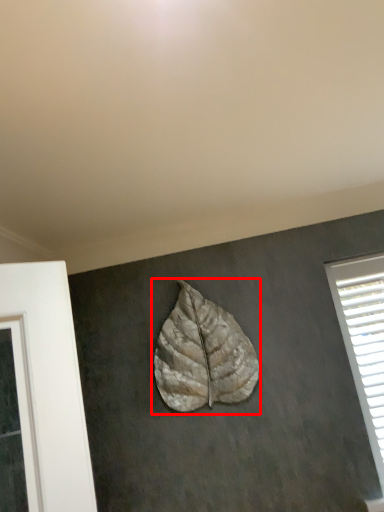
Question: From the image's perspective, what is the correct spatial relationship of leaf (annotated by the red box) in relation to window?

Choices:
 (A) below
 (B) above

Answer: (B)